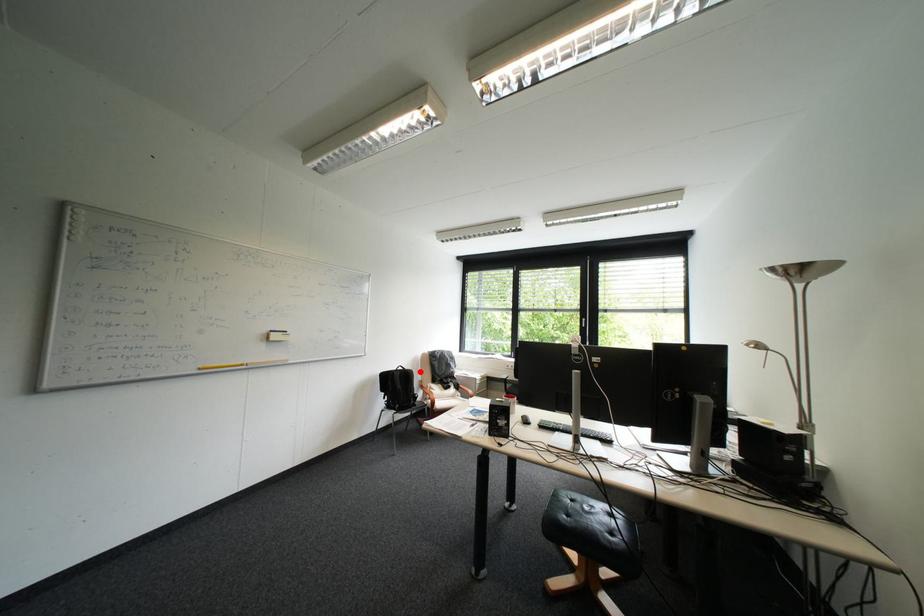
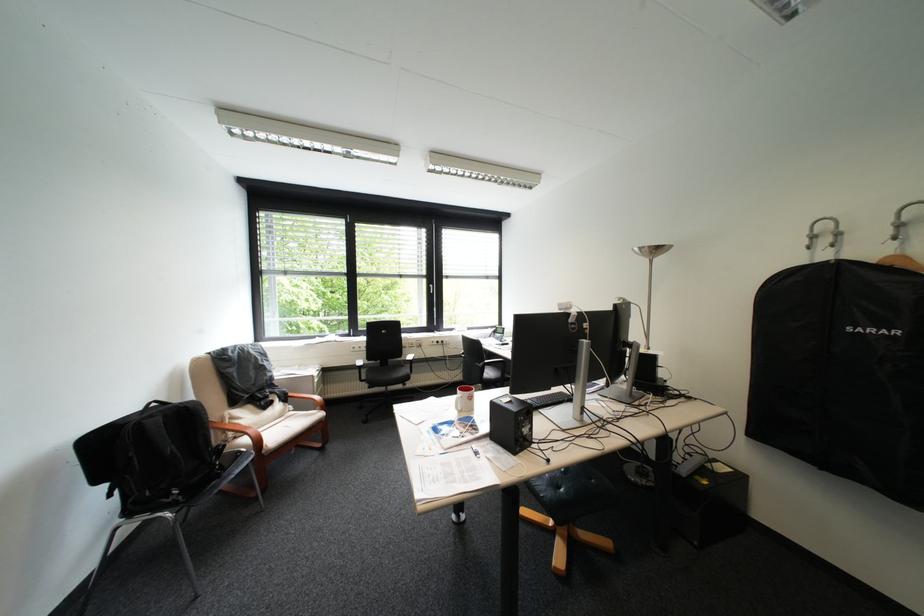
Find the pixel in the second image that matches the highlighted location in the first image.

(199, 407)